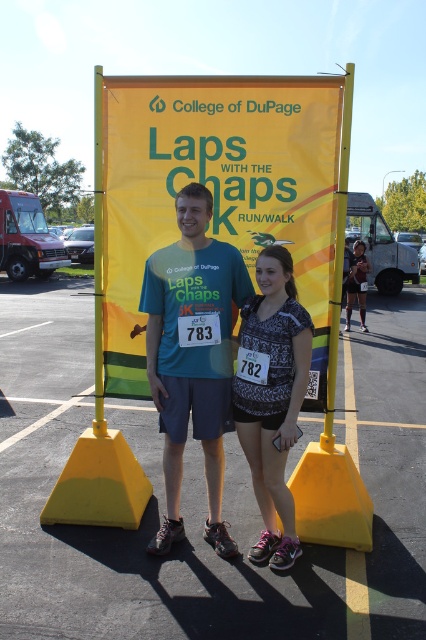
Question: Is yellow fabric banner at center positioned at the back of teal fabric shirt at center?

Choices:
 (A) no
 (B) yes

Answer: (A)

Question: Where is yellow fabric banner at center located in relation to patterned fabric shorts at center in the image?

Choices:
 (A) below
 (B) above

Answer: (B)

Question: Among these objects, which one is nearest to the camera?

Choices:
 (A) matte black tank top at center
 (B) yellow fabric banner at center

Answer: (B)

Question: Which point appears farthest from the camera in this image?

Choices:
 (A) (310, 547)
 (B) (147, 182)

Answer: (B)

Question: Does yellow rubber cone at center appear on the left side of yellow fabric banner at center?

Choices:
 (A) no
 (B) yes

Answer: (A)

Question: Which point is closer to the camera?

Choices:
 (A) matte black tank top at center
 (B) yellow rubber cone at center

Answer: (B)